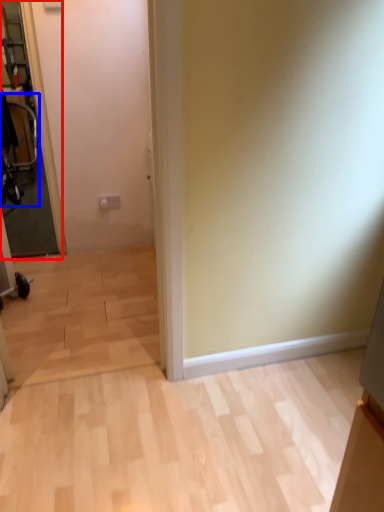
Question: Which of the following is the farthest to the observer, glass door (highlighted by a red box) or swivel chair (highlighted by a blue box)?

Choices:
 (A) glass door
 (B) swivel chair

Answer: (B)